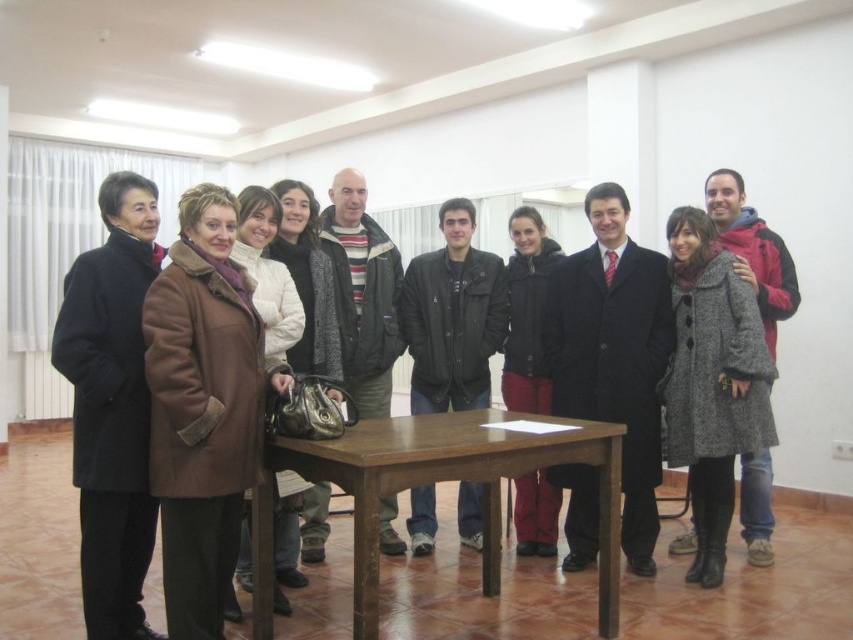
You are organizing a charity event and need to arrange coats on a rack based on their height. The rack has two levels, with the lower level for shorter items and the upper level for taller ones. Given the brown woolen coat at left and the matte black coat at center, which coat should be placed on the lower level?

The brown woolen coat at left should be placed on the lower level because it has a lesser height compared to the matte black coat at center.

You are organizing a clothing donation drive and need to stack the brown woolen coat at left and the matte black coat at center vertically. Which coat should you place at the bottom to ensure stability?

The matte black coat at center is larger than the brown woolen coat at left, so placing the larger matte black coat at center at the bottom will provide better stability for the stack.